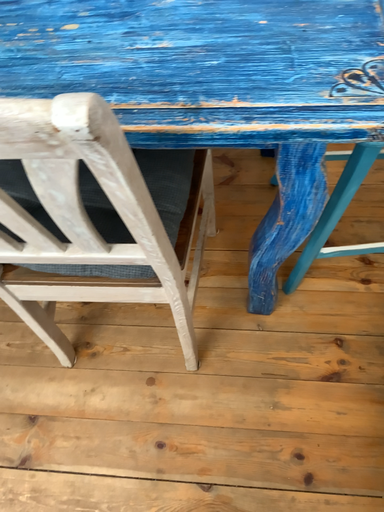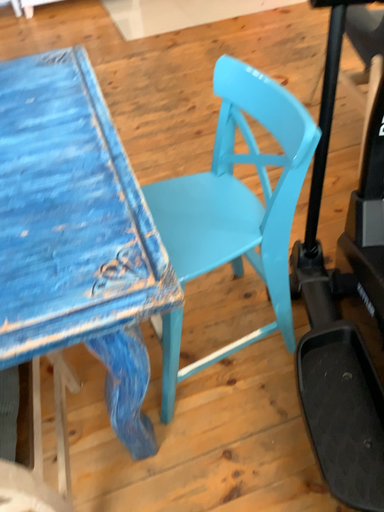
Question: Which way did the camera rotate in the video?

Choices:
 (A) rotated left
 (B) rotated right

Answer: (B)